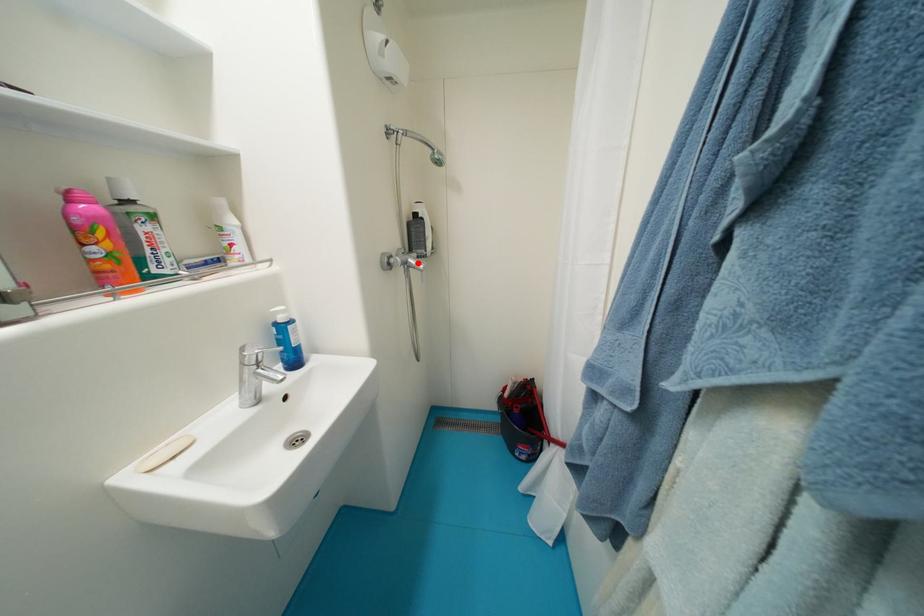
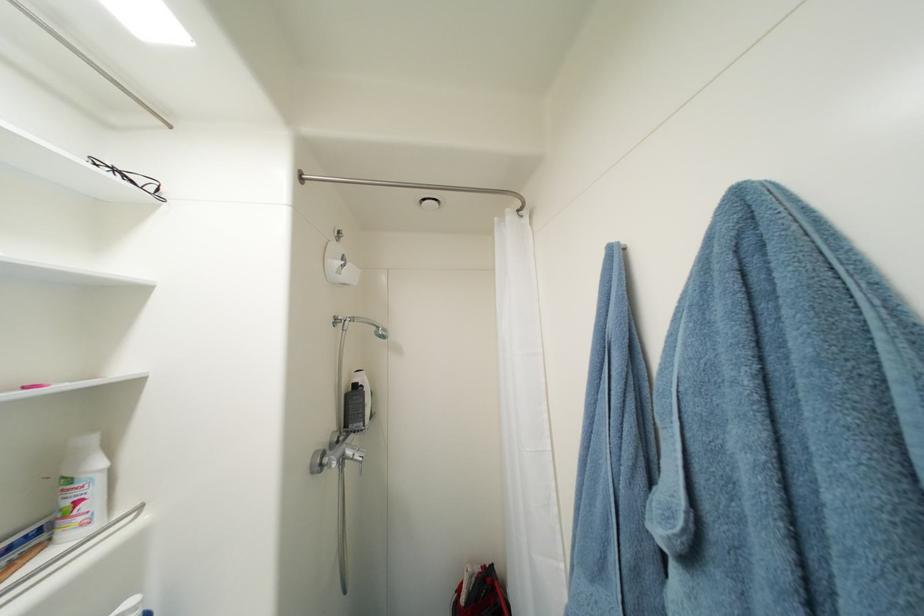
Find the pixel in the second image that matches the highlighted location in the first image.

(356, 454)